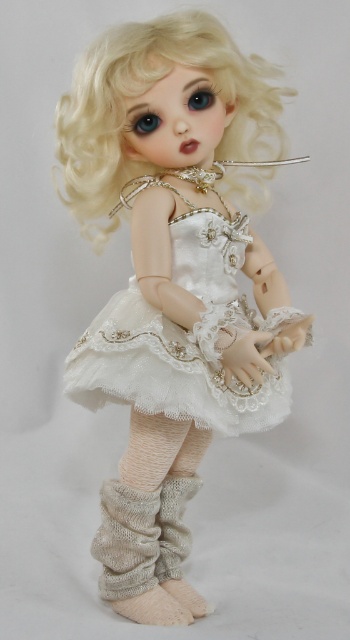
Can you confirm if blonde curly hair at upper center is positioned to the left of knitted beige boot at lower center?

Indeed, blonde curly hair at upper center is positioned on the left side of knitted beige boot at lower center.

Is point (98, 49) less distant than point (194, 481)?

Yes, point (98, 49) is in front of point (194, 481).

The height and width of the screenshot is (640, 350). What are the coordinates of `blonde curly hair at upper center` in the screenshot? It's located at (144, 92).

The width and height of the screenshot is (350, 640). What do you see at coordinates (171, 284) in the screenshot? I see `white satin dress at center` at bounding box center [171, 284].

Between white satin dress at center and white lace dress at center, which one has less height?

white lace dress at center is shorter.

Which is in front, point (64, 156) or point (295, 317)?

Point (295, 317) is in front.

This screenshot has height=640, width=350. What are the coordinates of `white satin dress at center` in the screenshot? It's located at (171, 284).

Which of these two, white satin dress at center or blonde curly hair at upper center, stands shorter?

blonde curly hair at upper center is shorter.

Who is positioned more to the right, white satin dress at center or blonde curly hair at upper center?

white satin dress at center is more to the right.

Which is behind, point (240, 225) or point (68, 156)?

The point (240, 225) is more distant.

You are a GUI agent. You are given a task and a screenshot of the screen. Output one action in this format:
    pyautogui.click(x=<x>, y=<y>)
    Task: Click on the white satin dress at center
    Image resolution: width=350 pixels, height=640 pixels.
    Given the screenshot: What is the action you would take?
    pyautogui.click(x=171, y=284)